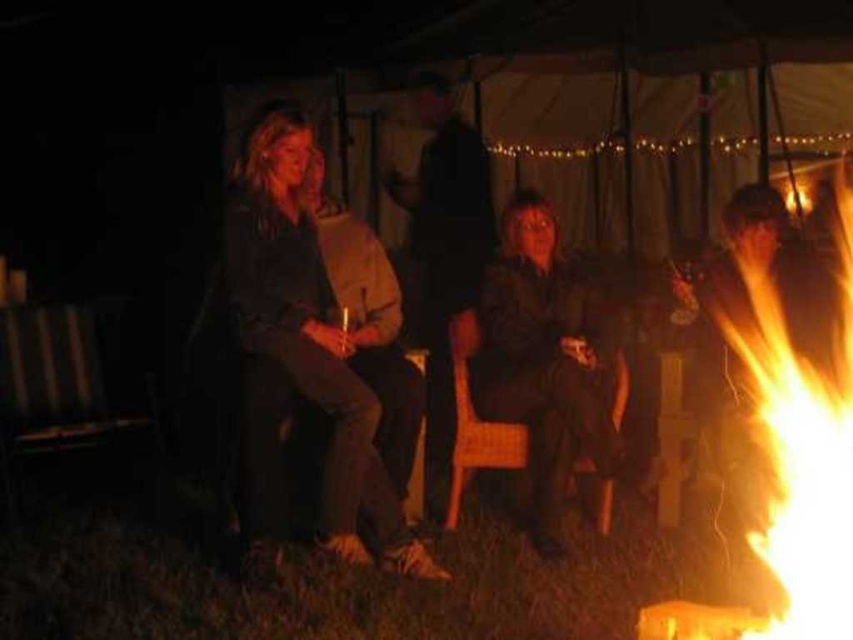
Can you confirm if flamematerial/texture at right is positioned above matte brown jacket at center?

No, flamematerial/texture at right is not above matte brown jacket at center.

Can you confirm if flamematerial/texture at right is bigger than matte brown jacket at center?

Correct, flamematerial/texture at right is larger in size than matte brown jacket at center.

Identify the location of flamematerial/texture at right. This screenshot has height=640, width=853. (786, 435).

You are a GUI agent. You are given a task and a screenshot of the screen. Output one action in this format:
    pyautogui.click(x=<x>, y=<y>)
    Task: Click on the flamematerial/texture at right
    The image size is (853, 640).
    Given the screenshot: What is the action you would take?
    pyautogui.click(x=786, y=435)

Can you confirm if flamematerial/texture at right is thinner than dark brown leather jacket at left?

Incorrect, flamematerial/texture at right's width is not less than dark brown leather jacket at left's.

Between flamematerial/texture at right and dark brown leather jacket at left, which one appears on the left side from the viewer's perspective?

Positioned to the left is dark brown leather jacket at left.

Between point (834, 387) and point (253, 500), which one is positioned in front?

Point (253, 500) is in front.

Identify the location of flamematerial/texture at right. The height and width of the screenshot is (640, 853). (786, 435).

Does matte brown jacket at center have a lesser height compared to wooden chair at center?

No, matte brown jacket at center is not shorter than wooden chair at center.

Does matte brown jacket at center appear over wooden chair at center?

Yes, matte brown jacket at center is above wooden chair at center.

Who is more forward, (370, 360) or (515, 445)?

Positioned in front is point (370, 360).

The width and height of the screenshot is (853, 640). Identify the location of matte brown jacket at center. (372, 332).